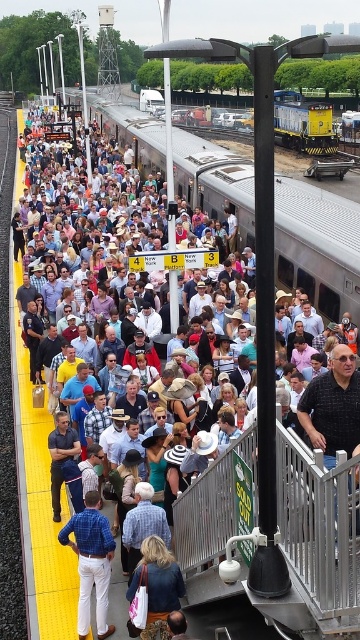
Question: Considering the relative positions of metallic silver rail at center and silver metallic train at center in the image provided, where is metallic silver rail at center located with respect to silver metallic train at center?

Choices:
 (A) left
 (B) right

Answer: (B)

Question: Does metallic silver rail at center appear on the right side of silver metallic train at center?

Choices:
 (A) no
 (B) yes

Answer: (B)

Question: Which point is closer to the camera taking this photo?

Choices:
 (A) (232, 500)
 (B) (146, 154)

Answer: (A)

Question: Which point is closer to the camera taking this photo?

Choices:
 (A) (250, 212)
 (B) (234, 458)

Answer: (B)

Question: Where is metallic silver rail at center located in relation to silver metallic train at center in the image?

Choices:
 (A) left
 (B) right

Answer: (B)

Question: Which point is closer to the camera?

Choices:
 (A) metallic silver rail at center
 (B) silver metallic train at center

Answer: (A)